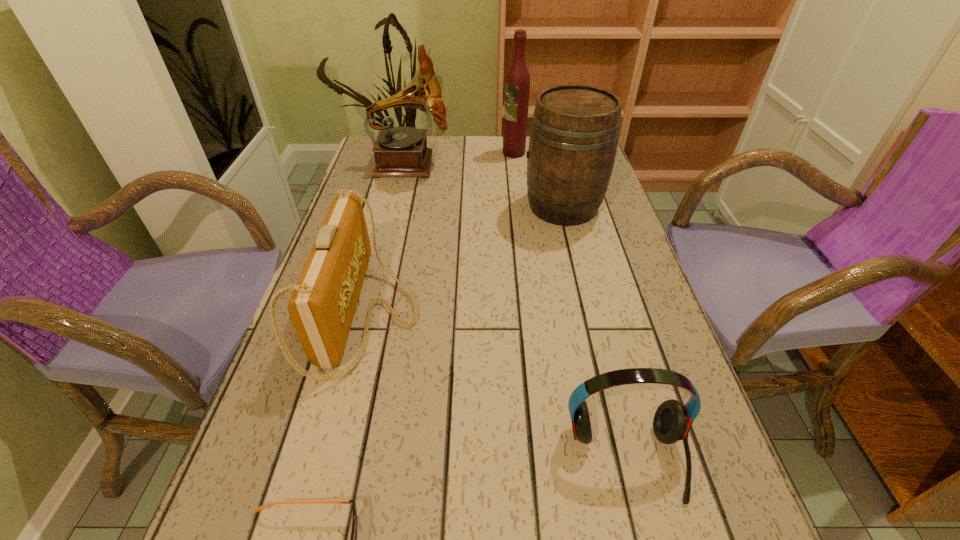
Find the location of a particular element. The height and width of the screenshot is (540, 960). vacant area that lies between the third nearest object and the third farthest object is located at coordinates (465, 261).

Where is `empty location between the headset and the third shortest object`? empty location between the headset and the third shortest object is located at coordinates (496, 387).

Find the location of a particular element. object that can be found as the third closest to the liquor is located at coordinates tap(322, 306).

Select which object appears as the fifth closest to the phonograph_record. Please provide its 2D coordinates. Your answer should be formatted as a tuple, i.e. [(x, y)], where the tuple contains the x and y coordinates of a point satisfying the conditions above.

[(353, 537)]